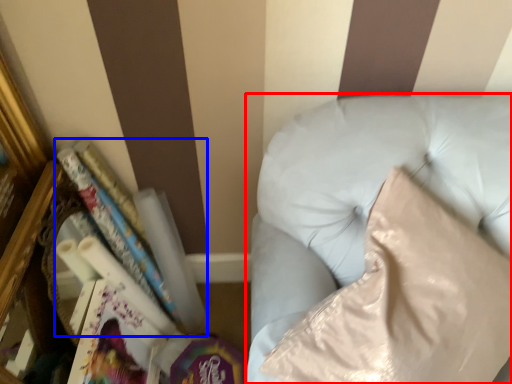
Question: Which object appears farthest to the camera in this image, furniture (highlighted by a red box) or book (highlighted by a blue box)?

Choices:
 (A) furniture
 (B) book

Answer: (B)